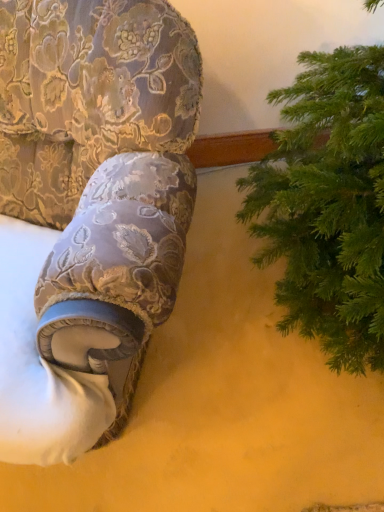
What is the approximate height of velvet floral-patterned armchair at left?

velvet floral-patterned armchair at left is 36.61 inches in height.

The height and width of the screenshot is (512, 384). Identify the location of velvet floral-patterned armchair at left. (88, 209).

What do you see at coordinates (88, 209) in the screenshot? Image resolution: width=384 pixels, height=512 pixels. I see `velvet floral-patterned armchair at left` at bounding box center [88, 209].

This screenshot has height=512, width=384. Identify the location of velvet floral-patterned armchair at left. (88, 209).